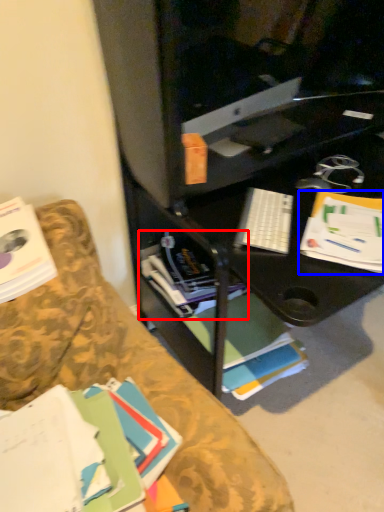
Question: Which object appears closest to the camera in this image, book (highlighted by a red box) or paperback book (highlighted by a blue box)?

Choices:
 (A) book
 (B) paperback book

Answer: (B)